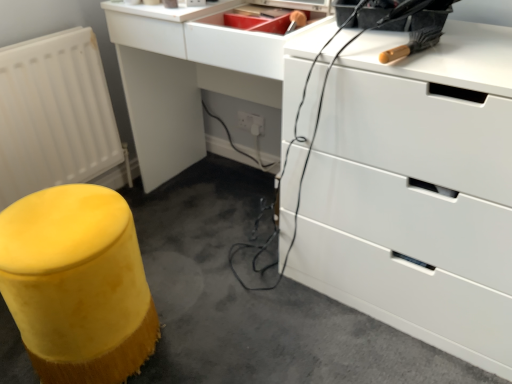
At what (x,y) coordinates should I click in order to perform the action: click on free space that is in between white glossy chest of drawers at upper right and yellow fuzzy stool at lower left. Please return your answer as a coordinate pair (x, y). Looking at the image, I should click on (267, 321).